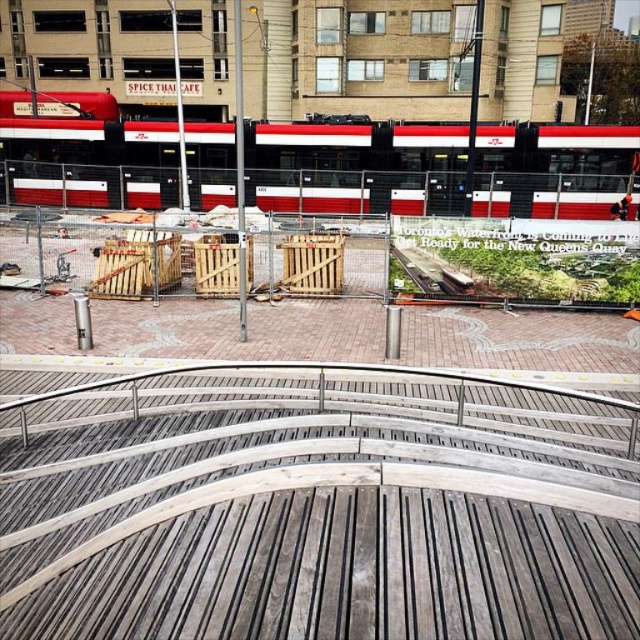
Question: Can you confirm if wooden crates at center is positioned to the right of red and white metal passenger train at upper center?

Choices:
 (A) no
 (B) yes

Answer: (A)

Question: Which object appears closest to the camera in this image?

Choices:
 (A) wooden crates at center
 (B) red and white metal passenger train at upper center

Answer: (A)

Question: Where is wooden crates at center located in relation to red and white metal passenger train at upper center in the image?

Choices:
 (A) below
 (B) above

Answer: (A)

Question: Is wooden crates at center bigger than red and white metal passenger train at upper center?

Choices:
 (A) no
 (B) yes

Answer: (A)

Question: Which point is farther to the camera?

Choices:
 (A) (3, 108)
 (B) (563, 474)

Answer: (A)